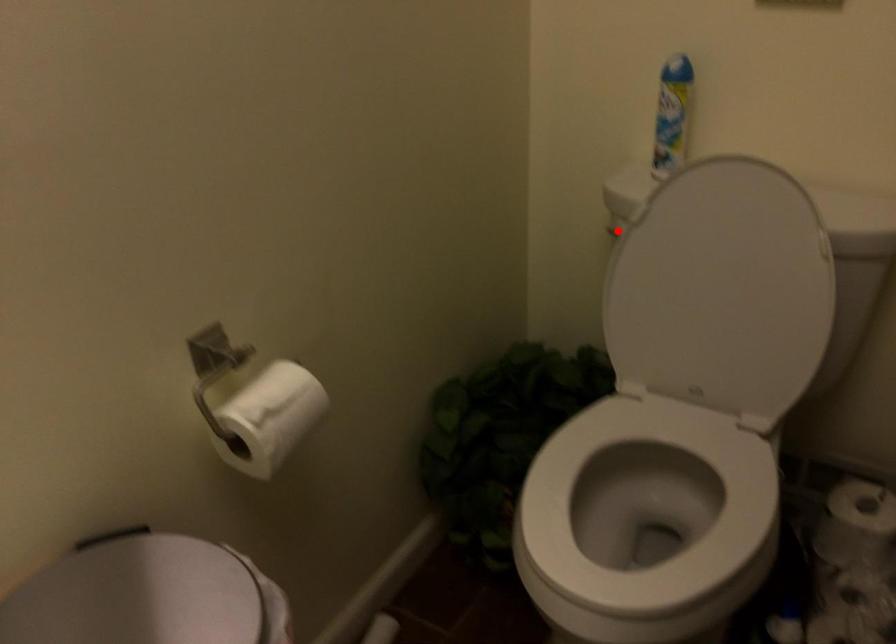
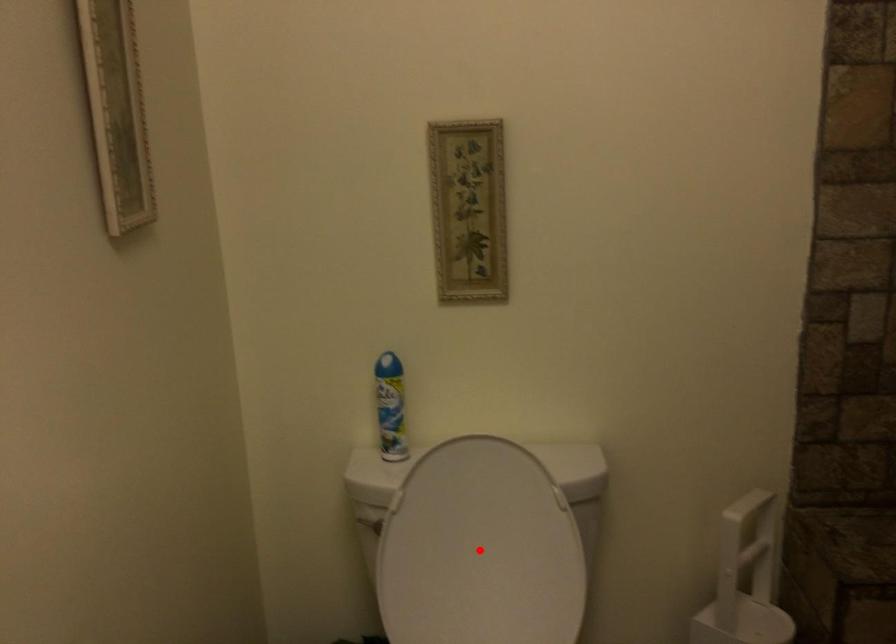
I am providing you with two images of the same scene from different viewpoints. A red point is marked on the first image and another point is marked on the second image. Is the red point in image1 aligned with the point shown in image2?

No